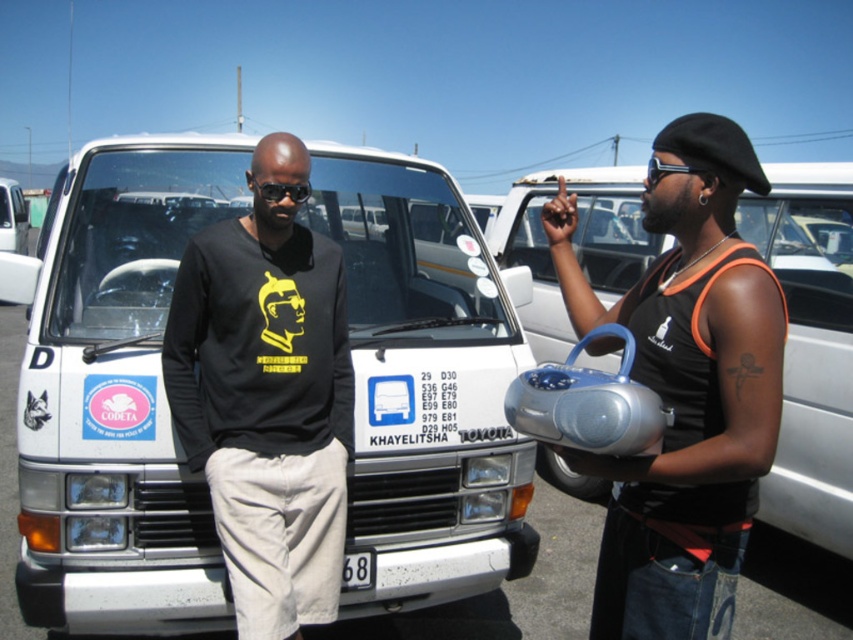
You are trying to locate the metallic silver boombox at right and the black matte shirt at center in the parking lot scene. According to the scene, which object is positioned to the right of the other?

The metallic silver boombox at right is positioned on the right side of black matte shirt at center.

Consider the image. You are standing at the point closest to the van. Which of the two points, point (x=141, y=294) or point (x=314, y=605), is located behind the other?

Point (x=141, y=294) is behind point (x=314, y=605).